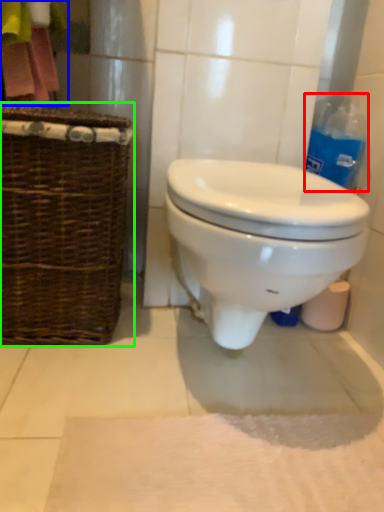
Question: Which object is the farthest from cleaning product (highlighted by a red box)? Choose among these: laundry (highlighted by a blue box) or picnic basket (highlighted by a green box).

Choices:
 (A) laundry
 (B) picnic basket

Answer: (A)